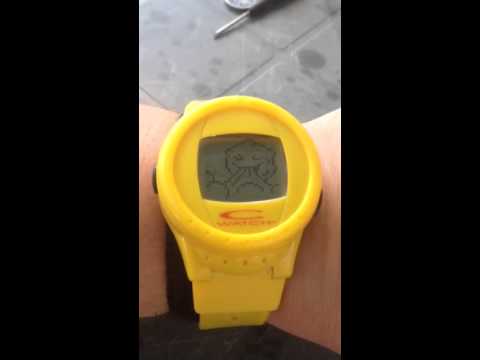
Image resolution: width=480 pixels, height=360 pixels. In order to click on floor in this screenshot , I will do `click(197, 65)`.